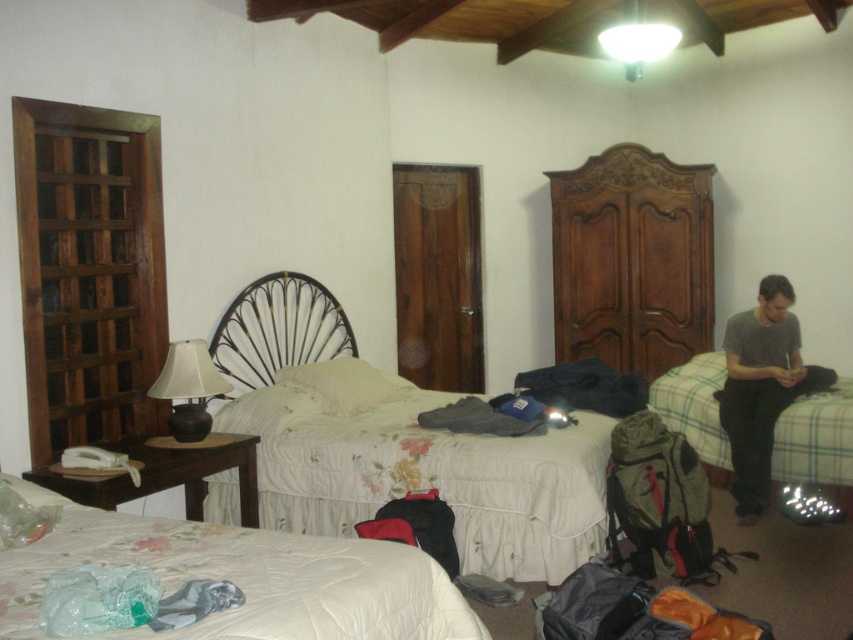
You are a delivery person who needs to place a package that is 1.2 meters long in this bedroom. Can you find a space between the brown polished wood armoire at center right and the gray cotton shirt at right to place it?

The distance between the brown polished wood armoire at center right and the gray cotton shirt at right is 1.19 meters, which is slightly shorter than the package length of 1.2 meters. Therefore, the package cannot be placed in that space.

You are standing in the bedroom and want to reach both the point at coordinates point (x=268, y=301) and the point at coordinates point (x=316, y=605). Which point will you reach first?

You will reach the point at coordinates point (x=268, y=301) first because it is closer to you than the point at coordinates point (x=316, y=605), which is further away.